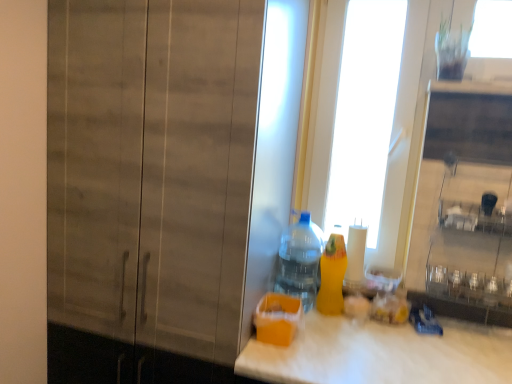
The image size is (512, 384). What do you see at coordinates (151, 169) in the screenshot? I see `wooden cabinet at left` at bounding box center [151, 169].

What is the approximate height of yellow matte bottle at right, the first bottle viewed from the right?

13.97 inches.

What are the coordinates of `yellow matte bottle at right, the first bottle viewed from the right` in the screenshot? It's located at (332, 276).

This screenshot has width=512, height=384. In order to click on transparent glass door at upper center in this screenshot , I will do `click(404, 142)`.

Considering the sizes of transparent glass door at upper center and yellow matte bottle at right, the first bottle viewed from the right, in the image, is transparent glass door at upper center taller or shorter than yellow matte bottle at right, the first bottle viewed from the right,?

In the image, transparent glass door at upper center appears to be taller than yellow matte bottle at right, the first bottle viewed from the right.

From the picture: From a real-world perspective, between transparent glass door at upper center and yellow matte bottle at right, marked as the 2th bottle in a left-to-right arrangement, who is vertically lower?

From a 3D spatial view, yellow matte bottle at right, marked as the 2th bottle in a left-to-right arrangement, is below.

Is transparent glass door at upper center turned away from yellow matte bottle at right, marked as the 2th bottle in a left-to-right arrangement?

No, transparent glass door at upper center is not facing the opposite direction of yellow matte bottle at right, marked as the 2th bottle in a left-to-right arrangement.

Is yellow matte bottle at right, the first bottle viewed from the right, taller or shorter than translucent plastic bottle at center, the 1th bottle positioned from the left?

yellow matte bottle at right, the first bottle viewed from the right, is shorter than translucent plastic bottle at center, the 1th bottle positioned from the left.

You are a GUI agent. You are given a task and a screenshot of the screen. Output one action in this format:
    pyautogui.click(x=<x>, y=<y>)
    Task: Click on the bottle above the yellow matte bottle at right, the first bottle viewed from the right (from a real-world perspective)
    This screenshot has width=512, height=384.
    Given the screenshot: What is the action you would take?
    pyautogui.click(x=300, y=261)

From the image's perspective, is yellow matte bottle at right, the first bottle viewed from the right, above or below translucent plastic bottle at center, the 1th bottle positioned from the left?

yellow matte bottle at right, the first bottle viewed from the right, is below translucent plastic bottle at center, the 1th bottle positioned from the left.

From a real-world perspective, is yellow matte bottle at right, marked as the 2th bottle in a left-to-right arrangement, located beneath translucent plastic bottle at center, the 1th bottle positioned from the left?

Yes, from a real-world perspective, yellow matte bottle at right, marked as the 2th bottle in a left-to-right arrangement, is below translucent plastic bottle at center, the 1th bottle positioned from the left.

From the image's perspective, would you say transparent glass door at upper center is shown under wooden cabinet at left?

No, from the image's perspective, transparent glass door at upper center is not below wooden cabinet at left.

Are transparent glass door at upper center and wooden cabinet at left located far from each other?

No, transparent glass door at upper center is not far away from wooden cabinet at left.

Considering the points (421, 22) and (230, 355), which point is in front, point (421, 22) or point (230, 355)?

The point (230, 355) is in front.

Which object is positioned more to the left, transparent glass door at upper center or wooden cabinet at left?

wooden cabinet at left.

Looking at their sizes, would you say yellow matte bottle at right, the first bottle viewed from the right, is wider or thinner than wooden cabinet at left?

Clearly, yellow matte bottle at right, the first bottle viewed from the right, has less width compared to wooden cabinet at left.

Would you say wooden cabinet at left is part of yellow matte bottle at right, the first bottle viewed from the right,'s contents?

No, wooden cabinet at left is not inside yellow matte bottle at right, the first bottle viewed from the right.

Could you tell me if yellow matte bottle at right, the first bottle viewed from the right, is turned towards wooden cabinet at left?

No.

Are yellow matte bottle at right, the first bottle viewed from the right, and wooden cabinet at left far apart?

A: No, there isn't a large distance between yellow matte bottle at right, the first bottle viewed from the right, and wooden cabinet at left.

Would you say wooden cabinet at left is to the left or to the right of transparent glass door at upper center in the picture?

Clearly, wooden cabinet at left is on the left of transparent glass door at upper center in the image.

From a real-world perspective, is wooden cabinet at left positioned under transparent glass door at upper center based on gravity?

Correct, in the physical world, wooden cabinet at left is lower than transparent glass door at upper center.

Considering the points (130, 188) and (410, 184), which point is in front, point (130, 188) or point (410, 184)?

The point (130, 188) is closer to the camera.

The width and height of the screenshot is (512, 384). Find the location of `barn door below the transparent glass door at upper center (from a real-world perspective)`. barn door below the transparent glass door at upper center (from a real-world perspective) is located at coordinates (151, 169).

Do you think translucent plastic bottle at center, the 1th bottle positioned from the left, is within transparent glass door at upper center, or outside of it?

translucent plastic bottle at center, the 1th bottle positioned from the left, is not inside transparent glass door at upper center, it's outside.

Are translucent plastic bottle at center, the 2th bottle from the right, and transparent glass door at upper center far apart?

No, translucent plastic bottle at center, the 2th bottle from the right, is not far from transparent glass door at upper center.

From a real-world perspective, between translucent plastic bottle at center, the 1th bottle positioned from the left, and transparent glass door at upper center, who is vertically lower?

In real-world perspective, translucent plastic bottle at center, the 1th bottle positioned from the left, is lower.

In the scene shown: Considering the relative positions of transparent glass door at upper center and translucent plastic bottle at center, the 2th bottle from the right, in the image provided, is transparent glass door at upper center behind translucent plastic bottle at center, the 2th bottle from the right,?

Yes, transparent glass door at upper center is further from the viewer.

Measure the distance between transparent glass door at upper center and translucent plastic bottle at center, the 1th bottle positioned from the left.

transparent glass door at upper center is 15.46 inches from translucent plastic bottle at center, the 1th bottle positioned from the left.

In the scene shown: How many degrees apart are the facing directions of transparent glass door at upper center and translucent plastic bottle at center, the 2th bottle from the right?

The facing directions of transparent glass door at upper center and translucent plastic bottle at center, the 2th bottle from the right, are 2.55 degrees apart.

Is transparent glass door at upper center wider or thinner than translucent plastic bottle at center, the 1th bottle positioned from the left?

transparent glass door at upper center is thinner than translucent plastic bottle at center, the 1th bottle positioned from the left.

Locate an element on the screen. Image resolution: width=512 pixels, height=384 pixels. glass door that appears behind the yellow matte bottle at right, the first bottle viewed from the right is located at coordinates (404, 142).

Find the location of a particular element. The height and width of the screenshot is (384, 512). bottle below the translucent plastic bottle at center, the 1th bottle positioned from the left (from a real-world perspective) is located at coordinates (332, 276).

From the image, which object appears to be nearer to translucent plastic bottle at center, the 1th bottle positioned from the left, yellow matte bottle at right, marked as the 2th bottle in a left-to-right arrangement, or wooden cabinet at left?

yellow matte bottle at right, marked as the 2th bottle in a left-to-right arrangement, is closer to translucent plastic bottle at center, the 1th bottle positioned from the left.

Considering their positions, is wooden cabinet at left positioned further to translucent plastic bottle at center, the 1th bottle positioned from the left, than yellow matte bottle at right, the first bottle viewed from the right?

wooden cabinet at left is positioned further to the anchor translucent plastic bottle at center, the 1th bottle positioned from the left.

Based on their spatial positions, is transparent glass door at upper center or translucent plastic bottle at center, the 1th bottle positioned from the left, further from yellow matte bottle at right, the first bottle viewed from the right?

transparent glass door at upper center.

Based on their spatial positions, is wooden cabinet at left or translucent plastic bottle at center, the 2th bottle from the right, further from transparent glass door at upper center?

wooden cabinet at left is further to transparent glass door at upper center.

Based on their spatial positions, is yellow matte bottle at right, the first bottle viewed from the right, or translucent plastic bottle at center, the 2th bottle from the right, closer to transparent glass door at upper center?

yellow matte bottle at right, the first bottle viewed from the right, lies closer to transparent glass door at upper center than the other object.

Considering their positions, is yellow matte bottle at right, marked as the 2th bottle in a left-to-right arrangement, positioned further to translucent plastic bottle at center, the 1th bottle positioned from the left, than transparent glass door at upper center?

transparent glass door at upper center is further to translucent plastic bottle at center, the 1th bottle positioned from the left.

Which object lies further to the anchor point yellow matte bottle at right, marked as the 2th bottle in a left-to-right arrangement, translucent plastic bottle at center, the 1th bottle positioned from the left, or transparent glass door at upper center?

Based on the image, transparent glass door at upper center appears to be further to yellow matte bottle at right, marked as the 2th bottle in a left-to-right arrangement.

Looking at the image, which one is located further to transparent glass door at upper center, wooden cabinet at left or yellow matte bottle at right, the first bottle viewed from the right?

wooden cabinet at left.

Identify the location of bottle between wooden cabinet at left and yellow matte bottle at right, marked as the 2th bottle in a left-to-right arrangement, in the horizontal direction. (300, 261).

The image size is (512, 384). Identify the location of bottle between transparent glass door at upper center and yellow matte bottle at right, the first bottle viewed from the right, in the up-down direction. (300, 261).